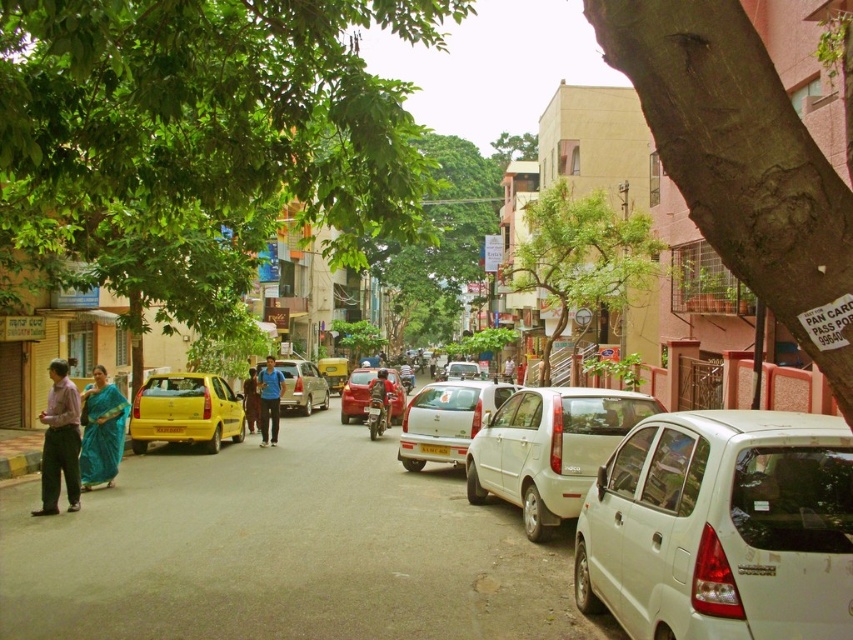
You are a delivery person trying to cross the street from the right side to the left side. There is a white matte hatchback at center and a blue silk saree at lower left in your view. Which object is nearer to you as you prepare to cross?

The white matte hatchback at center is closer to the viewer than the blue silk saree at lower left, so the white matte hatchback at center would be nearer as you prepare to cross.

You are a pedestrian standing on the sidewalk and see a white matte car at center and a blue fabric dress at center. Which object is higher in the image?

The white matte car at center is higher than the blue fabric dress at center in the image.

You are standing at the point marked by the coordinates point [445,419] in the image. What object are you directly at?

You are directly at the white matte car at center.